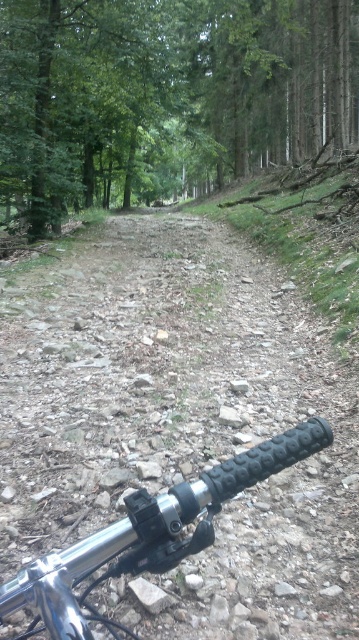
Question: Which point is closer to the camera?

Choices:
 (A) green matte tree at center
 (B) dusty gravel path at center

Answer: (B)

Question: Is green matte tree at center to the left of black rubber handlebar at lower right from the viewer's perspective?

Choices:
 (A) yes
 (B) no

Answer: (A)

Question: Which point is farther to the camera?

Choices:
 (A) (103, 532)
 (B) (202, 172)

Answer: (B)

Question: Is dusty gravel path at center further to the viewer compared to black rubber handlebar at lower right?

Choices:
 (A) yes
 (B) no

Answer: (A)

Question: Which point is closer to the camera?

Choices:
 (A) black rubber handlebar at lower right
 (B) dusty gravel path at center

Answer: (A)

Question: Observing the image, what is the correct spatial positioning of green matte tree at center in reference to black rubber handlebar at lower right?

Choices:
 (A) left
 (B) right

Answer: (A)